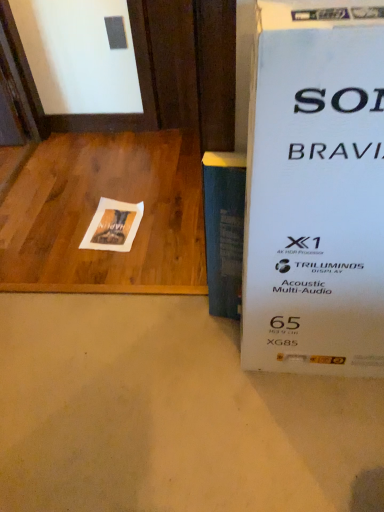
Question: Is point (125, 243) positioned closer to the camera than point (221, 261)?

Choices:
 (A) closer
 (B) farther

Answer: (B)

Question: In terms of height, does white paper at center look taller or shorter compared to blue matte book at center?

Choices:
 (A) tall
 (B) short

Answer: (B)

Question: Estimate the real-world distances between objects in this image. Which object is farther from the wooden at left?

Choices:
 (A) blue matte book at center
 (B) white paper at center

Answer: (A)

Question: Based on their relative distances, which object is nearer to the wooden at left?

Choices:
 (A) white paper at center
 (B) blue matte book at center

Answer: (A)